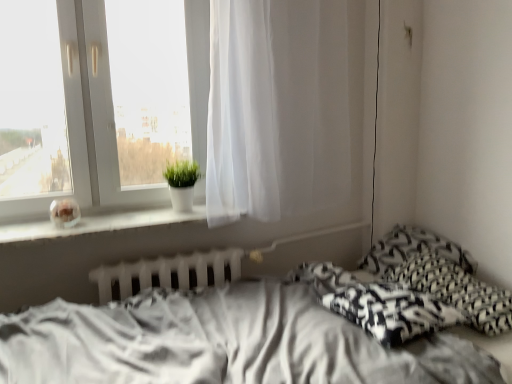
Locate an element on the screen. The height and width of the screenshot is (384, 512). vacant area on top of white matte window sill at left (from a real-world perspective) is located at coordinates (122, 217).